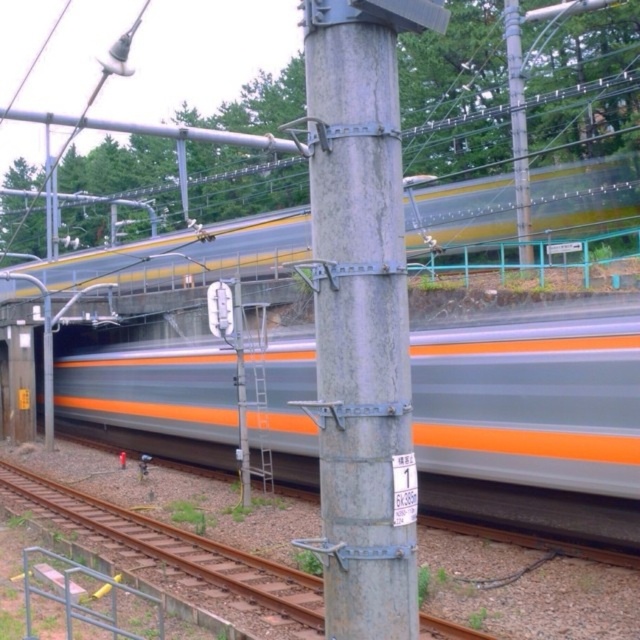
You are a railway engineer analyzing the position of the silver metallic train at center. According to the coordinates provided, where exactly is the train positioned in the image?

The silver metallic train at center is located at point 0.619 along the x axis and 0.833 along the y axis.

You are standing at the railway station and see the silver metallic train at center and the metallic gray telegraph pole at upper center. Which object is positioned more to the left?

The silver metallic train at center is positioned to the left of the metallic gray telegraph pole at upper center, so it is more to the left.

You are a photographer standing at the railway station. You want to take a photo of the gray metallic pole at center without the silver metallic train at center blocking it. Is the pole currently visible in your view?

The gray metallic pole at center is behind the silver metallic train at center, so it is currently blocked by the train and not visible in your view.